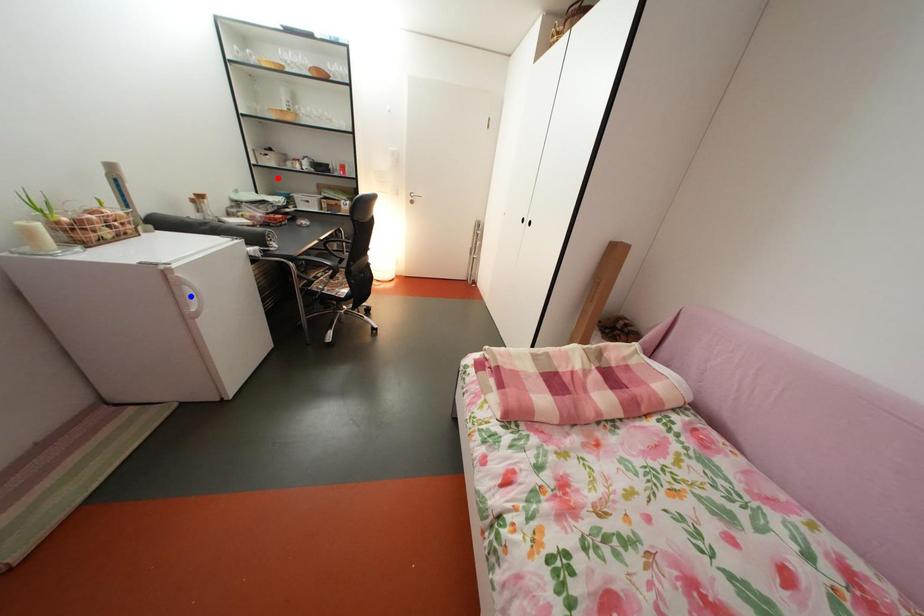
Question: Which of the two points in the image is closer to the camera?

Choices:
 (A) Blue point is closer.
 (B) Red point is closer.

Answer: (A)